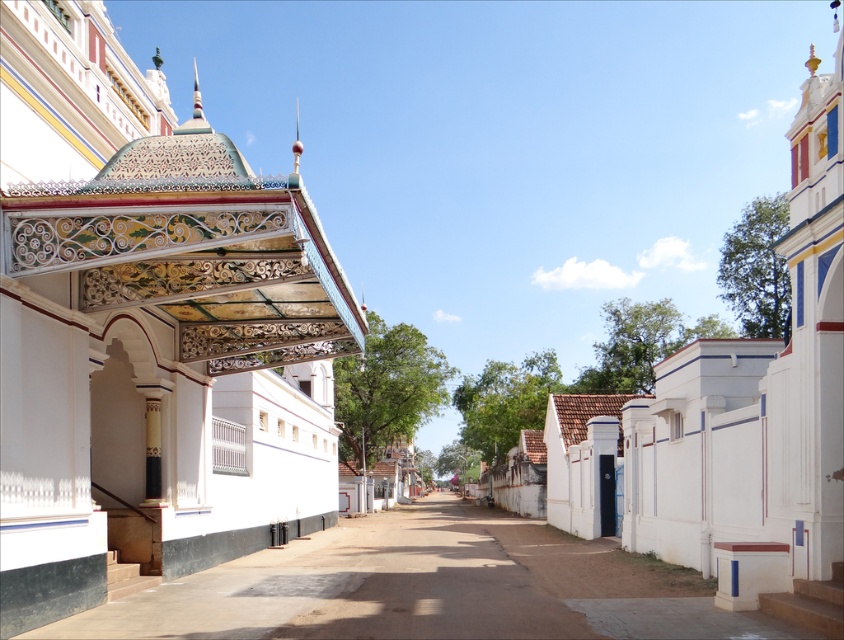
You are standing at the camera position and want to take a photo of the decorative painted ceiling at upper left. Is the distance between you and the ceiling sufficient to capture it clearly with a standard camera lens?

The distance between you and the decorative painted ceiling at upper left is 9.27 meters. A standard camera lens typically has a focal length of around 50mm, which can easily capture objects at this distance. Therefore, the distance is sufficient to take a clear photo.

You are an architect analyzing the temple complex. You notice the decorative painted ceiling at upper left and the white painted wall at center. Which of these two elements has a greater height in the image?

The decorative painted ceiling at upper left is taller than the white painted wall at center according to the description.

You are a visitor walking along the street in this temple complex. You notice a white painted wall at center and a smooth concrete alley at center. Which one is higher in position?

The white painted wall at center is above the smooth concrete alley at center, so it is higher in position.